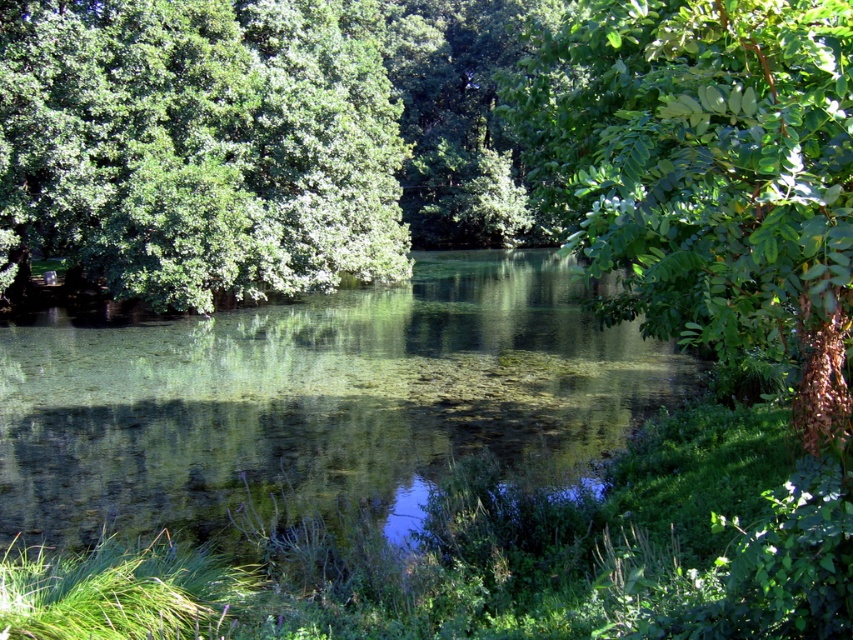
Question: Which is farther from the clear water at center?

Choices:
 (A) green leafy tree at upper right
 (B) green leafy tree at center

Answer: (A)

Question: From the image, what is the correct spatial relationship of clear water at center in relation to green leafy tree at center?

Choices:
 (A) below
 (B) above

Answer: (A)

Question: Which of these objects is positioned farthest from the green leafy tree at center?

Choices:
 (A) clear water at center
 (B) green leafy tree at upper right

Answer: (B)

Question: Observing the image, what is the correct spatial positioning of clear water at center in reference to green leafy tree at center?

Choices:
 (A) right
 (B) left

Answer: (A)

Question: Among these objects, which one is nearest to the camera?

Choices:
 (A) green leafy tree at center
 (B) clear water at center
 (C) green leafy tree at upper right

Answer: (C)

Question: Is the position of green leafy tree at center more distant than that of green leafy tree at upper right?

Choices:
 (A) no
 (B) yes

Answer: (B)